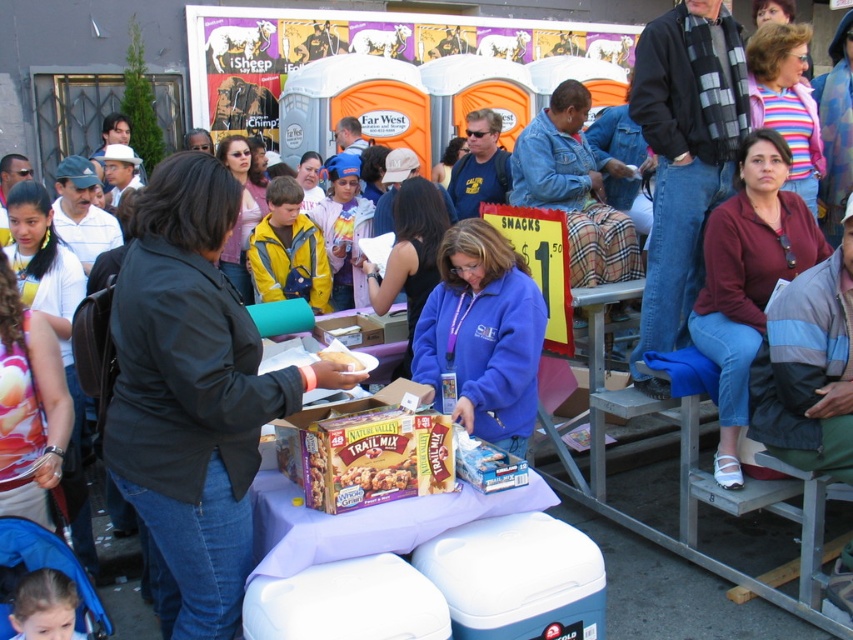
You are standing at the entrance of the outdoor event and see the black matte jacket at center. Can you estimate how far it is from the banner in the background?

The black matte jacket at center is located at point (x=192, y=396), but without specific coordinates for the banner, it is impossible to determine the exact distance between them.